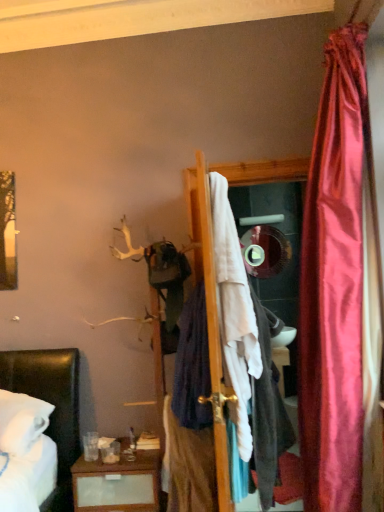
The image size is (384, 512). What do you see at coordinates (188, 466) in the screenshot?
I see `dark blue fabric at center, which appears as the third clothing when viewed from the right` at bounding box center [188, 466].

This screenshot has height=512, width=384. Find the location of `dark blue fabric at center, which appears as the third clothing when viewed from the right`. dark blue fabric at center, which appears as the third clothing when viewed from the right is located at coordinates (x=188, y=466).

What do you see at coordinates (192, 365) in the screenshot?
I see `dark blue fabric at center, which is the second clothing from left to right` at bounding box center [192, 365].

What are the coordinates of `white fabric at center, the 3th clothing positioned from the left` in the screenshot? It's located at (268, 410).

Measure the distance between point (268, 252) and camera.

Point (268, 252) is 12.64 feet from camera.

This screenshot has height=512, width=384. I want to click on dark blue fabric at center, which ranks as the 1th clothing in left-to-right order, so click(x=188, y=466).

Does dark blue fabric at center, which appears as the third clothing when viewed from the right, have a greater width compared to dark blue fabric at center, which is the second clothing from left to right?

Indeed, dark blue fabric at center, which appears as the third clothing when viewed from the right, has a greater width compared to dark blue fabric at center, which is the second clothing from left to right.

Is dark blue fabric at center, which appears as the third clothing when viewed from the right, far away from dark blue fabric at center, the 2th clothing positioned from the right?

No.

Considering the relative sizes of dark blue fabric at center, which appears as the third clothing when viewed from the right, and dark blue fabric at center, the 2th clothing positioned from the right, in the image provided, is dark blue fabric at center, which appears as the third clothing when viewed from the right, taller than dark blue fabric at center, the 2th clothing positioned from the right,?

No.

Which object is closer to the camera, white fabric at center, marked as the 1th clothing in a right-to-left arrangement, or dark blue fabric at center, the 2th clothing positioned from the right?

Positioned in front is white fabric at center, marked as the 1th clothing in a right-to-left arrangement.

Is white fabric at center, marked as the 1th clothing in a right-to-left arrangement, far away from dark blue fabric at center, the 2th clothing positioned from the right?

No, there isn't a large distance between white fabric at center, marked as the 1th clothing in a right-to-left arrangement, and dark blue fabric at center, the 2th clothing positioned from the right.

Would you say white fabric at center, marked as the 1th clothing in a right-to-left arrangement, is to the left or to the right of dark blue fabric at center, the 2th clothing positioned from the right, in the picture?

From the image, it's evident that white fabric at center, marked as the 1th clothing in a right-to-left arrangement, is to the right of dark blue fabric at center, the 2th clothing positioned from the right.

This screenshot has width=384, height=512. What are the coordinates of `clothing that is above the white fabric at center, marked as the 1th clothing in a right-to-left arrangement (from the image's perspective)` in the screenshot? It's located at (192, 365).

Considering the positions of objects dark blue fabric at center, the 2th clothing positioned from the right, and white fabric at center, marked as the 1th clothing in a right-to-left arrangement, in the image provided, who is more to the right, dark blue fabric at center, the 2th clothing positioned from the right, or white fabric at center, marked as the 1th clothing in a right-to-left arrangement,?

white fabric at center, marked as the 1th clothing in a right-to-left arrangement.

Which is less distant, (203, 291) or (211, 474)?

The point (211, 474) is in front.

Considering the sizes of objects dark blue fabric at center, which is the second clothing from left to right, and dark blue fabric at center, which appears as the third clothing when viewed from the right, in the image provided, who is thinner, dark blue fabric at center, which is the second clothing from left to right, or dark blue fabric at center, which appears as the third clothing when viewed from the right,?

With smaller width is dark blue fabric at center, which is the second clothing from left to right.

Considering the relative positions of dark blue fabric at center, the 2th clothing positioned from the right, and dark blue fabric at center, which ranks as the 1th clothing in left-to-right order, in the image provided, is dark blue fabric at center, the 2th clothing positioned from the right, in front of dark blue fabric at center, which ranks as the 1th clothing in left-to-right order,?

No, it is not.

Is dark blue fabric at center, the 2th clothing positioned from the right, taller than dark blue fabric at center, which ranks as the 1th clothing in left-to-right order?

Correct, dark blue fabric at center, the 2th clothing positioned from the right, is much taller as dark blue fabric at center, which ranks as the 1th clothing in left-to-right order.

Is dark blue fabric at center, which appears as the third clothing when viewed from the right, taller or shorter than shiny silver mirror at center?

dark blue fabric at center, which appears as the third clothing when viewed from the right, is taller than shiny silver mirror at center.

Would you say dark blue fabric at center, which appears as the third clothing when viewed from the right, is inside or outside shiny silver mirror at center?

dark blue fabric at center, which appears as the third clothing when viewed from the right, lies outside shiny silver mirror at center.

Which object is more forward, dark blue fabric at center, which ranks as the 1th clothing in left-to-right order, or shiny silver mirror at center?

dark blue fabric at center, which ranks as the 1th clothing in left-to-right order.

Between dark blue fabric at center, which is the second clothing from left to right, and shiny silver mirror at center, which one has less height?

shiny silver mirror at center is shorter.

Is dark blue fabric at center, the 2th clothing positioned from the right, positioned with its back to shiny silver mirror at center?

No, dark blue fabric at center, the 2th clothing positioned from the right, is not facing away from shiny silver mirror at center.

Is dark blue fabric at center, which is the second clothing from left to right, not near shiny silver mirror at center?

That's right, there is a large distance between dark blue fabric at center, which is the second clothing from left to right, and shiny silver mirror at center.

Is shiny silver mirror at center located outside dark blue fabric at center, which appears as the third clothing when viewed from the right?

shiny silver mirror at center is positioned outside dark blue fabric at center, which appears as the third clothing when viewed from the right.

Is shiny silver mirror at center closer to the viewer compared to dark blue fabric at center, which appears as the third clothing when viewed from the right?

No.

In the scene shown: Does shiny silver mirror at center have a greater width compared to dark blue fabric at center, which appears as the third clothing when viewed from the right?

In fact, shiny silver mirror at center might be narrower than dark blue fabric at center, which appears as the third clothing when viewed from the right.

Who is shorter, shiny silver mirror at center or dark blue fabric at center, which appears as the third clothing when viewed from the right?

Standing shorter between the two is shiny silver mirror at center.

Locate an element on the screen. The image size is (384, 512). clothing behind the dark blue fabric at center, which ranks as the 1th clothing in left-to-right order is located at coordinates (192, 365).

Image resolution: width=384 pixels, height=512 pixels. In order to click on clothing above the white fabric at center, marked as the 1th clothing in a right-to-left arrangement (from a real-world perspective) in this screenshot , I will do `click(192, 365)`.

Looking at the image, which one is located closer to shiny silver mirror at center, white fabric at center, the 3th clothing positioned from the left, or dark blue fabric at center, which is the second clothing from left to right?

white fabric at center, the 3th clothing positioned from the left, is closer to shiny silver mirror at center.

Based on their spatial positions, is dark blue fabric at center, which ranks as the 1th clothing in left-to-right order, or white fabric at center, the 3th clothing positioned from the left, further from dark blue fabric at center, the 2th clothing positioned from the right?

white fabric at center, the 3th clothing positioned from the left.

Based on their spatial positions, is shiny silver mirror at center or white fabric at center, marked as the 1th clothing in a right-to-left arrangement, closer to dark blue fabric at center, the 2th clothing positioned from the right?

white fabric at center, marked as the 1th clothing in a right-to-left arrangement.

Which object lies further to the anchor point dark blue fabric at center, which is the second clothing from left to right, dark blue fabric at center, which appears as the third clothing when viewed from the right, or shiny silver mirror at center?

Based on the image, shiny silver mirror at center appears to be further to dark blue fabric at center, which is the second clothing from left to right.

Estimate the real-world distances between objects in this image. Which object is closer to dark blue fabric at center, which ranks as the 1th clothing in left-to-right order, dark blue fabric at center, the 2th clothing positioned from the right, or shiny silver mirror at center?

dark blue fabric at center, the 2th clothing positioned from the right.

Looking at this image, estimate the real-world distances between objects in this image. Which object is closer to dark blue fabric at center, the 2th clothing positioned from the right, white fabric at center, the 3th clothing positioned from the left, or dark blue fabric at center, which appears as the third clothing when viewed from the right?

Based on the image, dark blue fabric at center, which appears as the third clothing when viewed from the right, appears to be nearer to dark blue fabric at center, the 2th clothing positioned from the right.

From the image, which object appears to be nearer to dark blue fabric at center, which ranks as the 1th clothing in left-to-right order, white fabric at center, the 3th clothing positioned from the left, or shiny silver mirror at center?

white fabric at center, the 3th clothing positioned from the left, is closer to dark blue fabric at center, which ranks as the 1th clothing in left-to-right order.

Looking at this image, from the image, which object appears to be farther from white fabric at center, marked as the 1th clothing in a right-to-left arrangement, shiny silver mirror at center or dark blue fabric at center, the 2th clothing positioned from the right?

shiny silver mirror at center lies further to white fabric at center, marked as the 1th clothing in a right-to-left arrangement, than the other object.

You are a GUI agent. You are given a task and a screenshot of the screen. Output one action in this format:
    pyautogui.click(x=<x>, y=<y>)
    Task: Click on the clothing between dark blue fabric at center, the 2th clothing positioned from the right, and dark blue fabric at center, which appears as the third clothing when viewed from the right, from top to bottom
    The height and width of the screenshot is (512, 384).
    Given the screenshot: What is the action you would take?
    pyautogui.click(x=268, y=410)

Where is `clothing between dark blue fabric at center, which appears as the third clothing when viewed from the right, and shiny silver mirror at center, along the z-axis`? The image size is (384, 512). clothing between dark blue fabric at center, which appears as the third clothing when viewed from the right, and shiny silver mirror at center, along the z-axis is located at coordinates (192, 365).